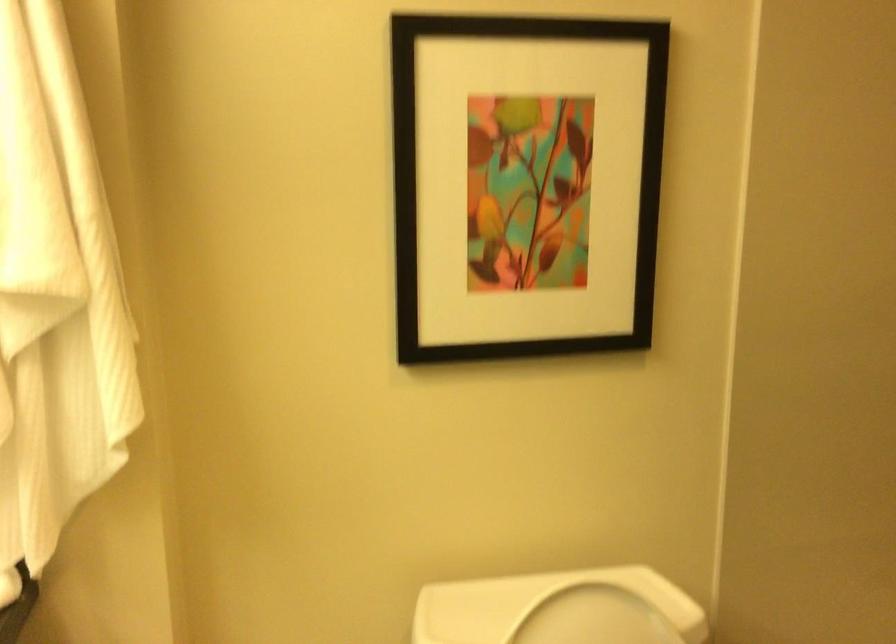
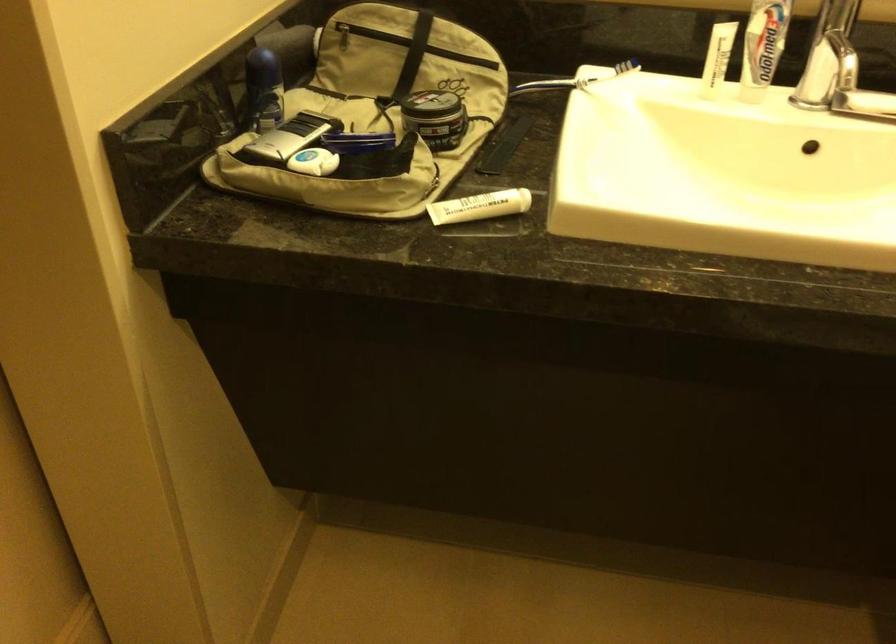
Based on the continuous images, in which direction is the camera rotating?

The rotation direction of the camera is left-down.